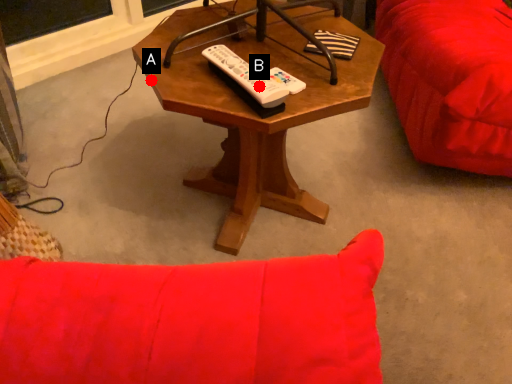
Question: Two points are circled on the image, labeled by A and B beside each circle. Which point is closer to the camera?

Choices:
 (A) A is closer
 (B) B is closer

Answer: (B)